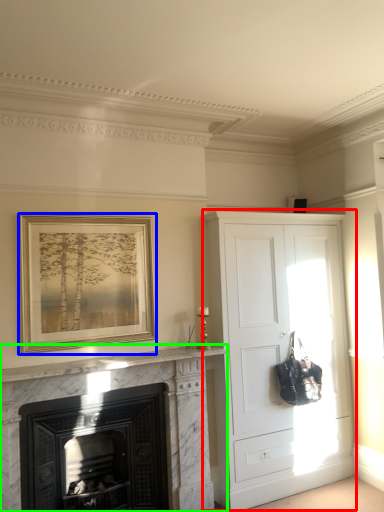
Question: Which object is positioned farthest from cupboard (highlighted by a red box)? Select from picture frame (highlighted by a blue box) and fireplace (highlighted by a green box).

Choices:
 (A) picture frame
 (B) fireplace

Answer: (A)